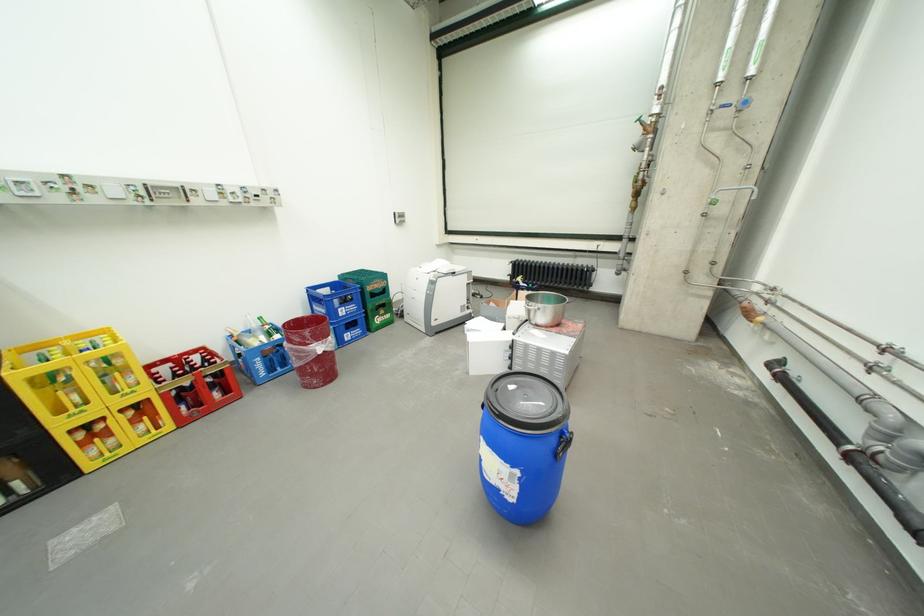
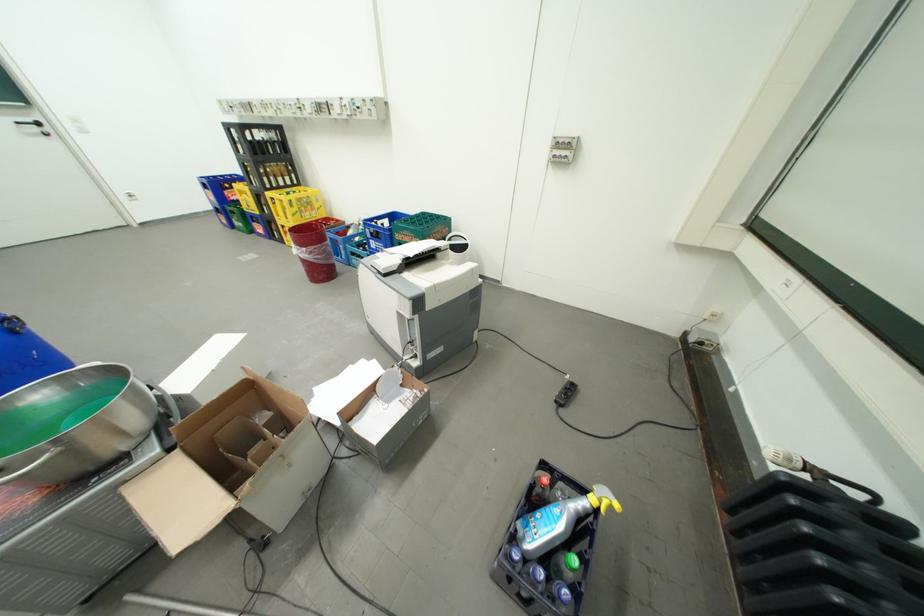
Locate, in the second image, the point that corresponds to pixel 339 339 in the first image.

(314, 249)